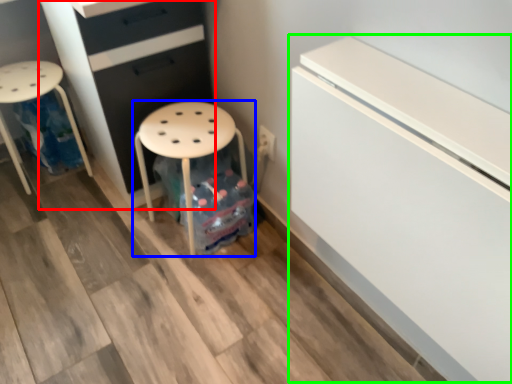
Question: Which is farther away from chest of drawers (highlighted by a red box)? stool (highlighted by a blue box) or fridge (highlighted by a green box)?

Choices:
 (A) stool
 (B) fridge

Answer: (B)